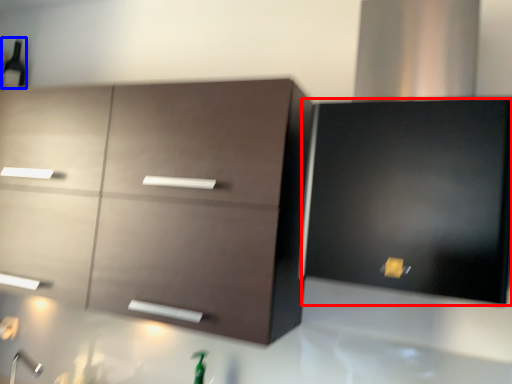
Question: Which object is further to the camera taking this photo, cabinetry (highlighted by a red box) or beer bottle (highlighted by a blue box)?

Choices:
 (A) cabinetry
 (B) beer bottle

Answer: (B)